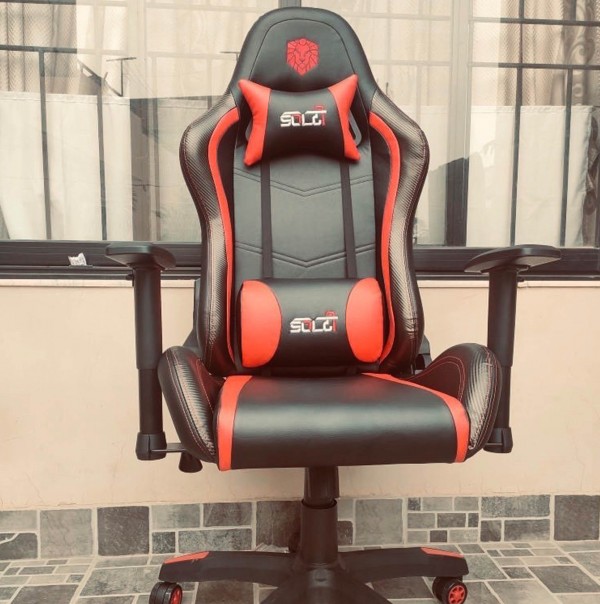
At what (x,y) coordinates should I click in order to perform the action: click on game chair. Please return your answer as a coordinate pair (x, y). Looking at the image, I should click on pos(313,259).